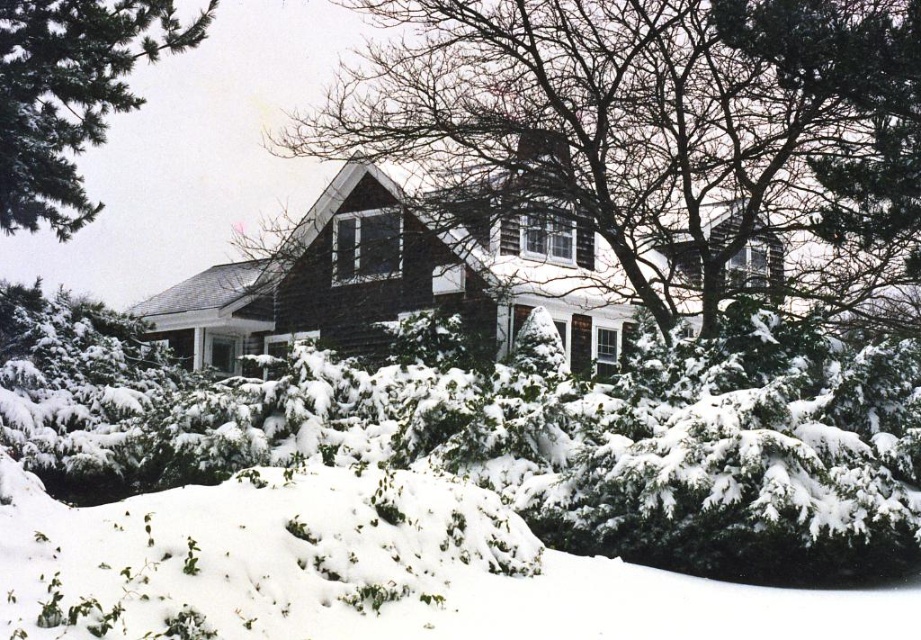
In the scene shown: You are an observer standing in front of the house. You notice the bare branches at center and the white fluffy snow at lower center. Which one is taller?

The bare branches at center is taller than the white fluffy snow at lower center.

You are standing at the center of the image and want to place a small snowman exactly where the bare branches at center are located. Is this possible?

The bare branches at center are located at coordinates point (654, 129), so yes, you can place the snowman there as long as the coordinates are accessible.